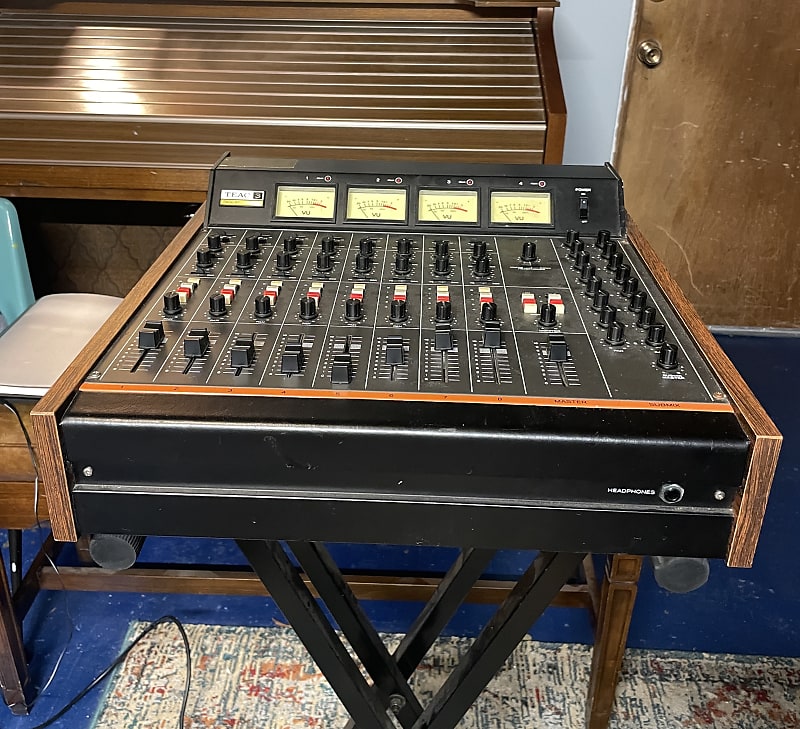
Where is `light blue wall`? This screenshot has width=800, height=729. light blue wall is located at coordinates (598, 70).